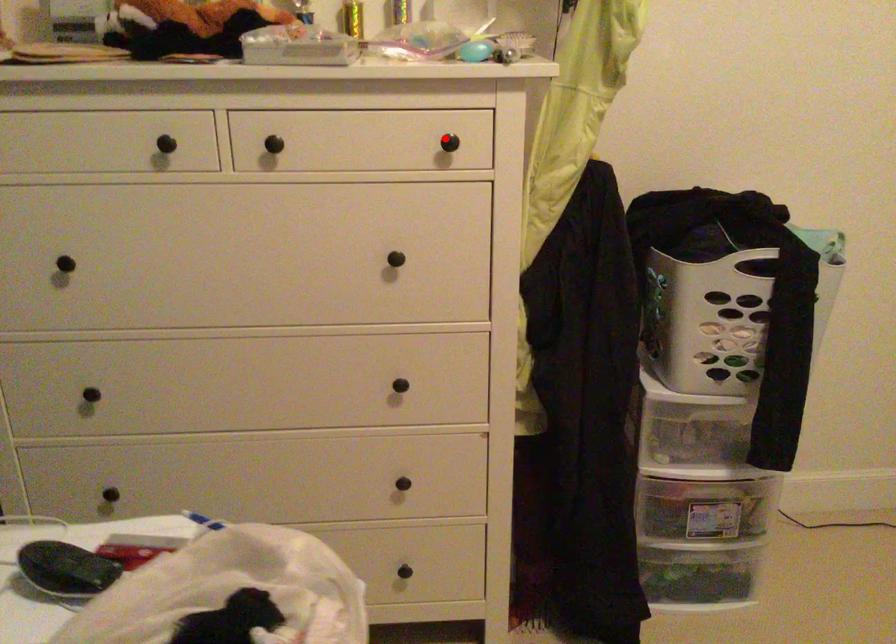
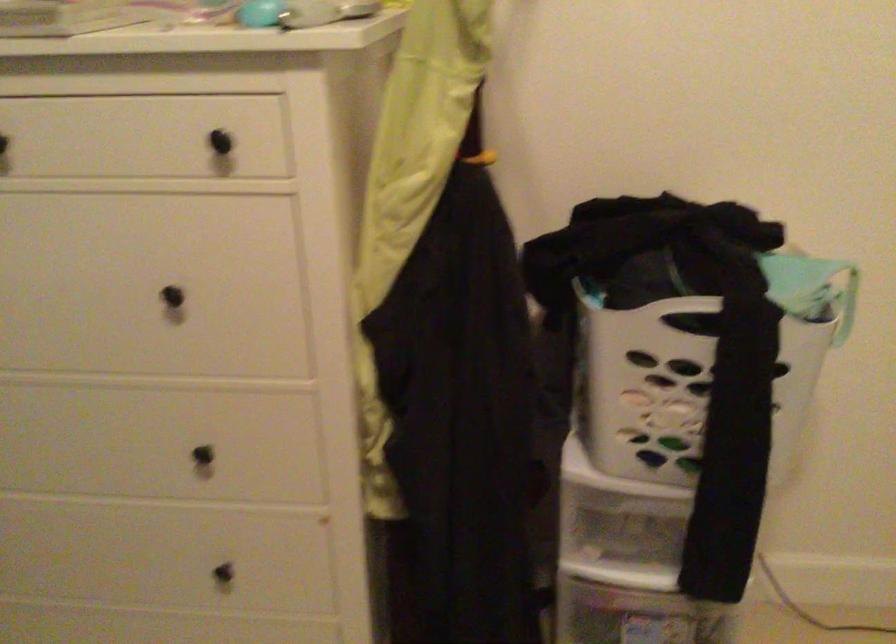
In the second image, find the point that corresponds to the highlighted location in the first image.

(220, 142)